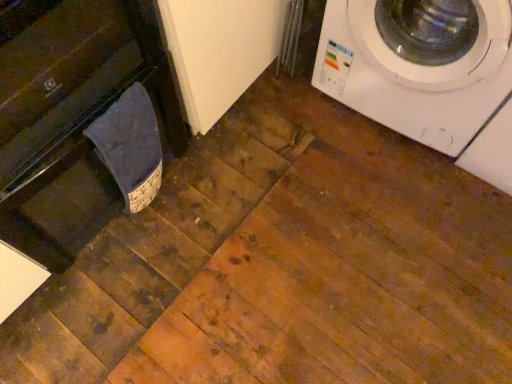
Question: Considering the positions of dark blue fabric at lower left and white glossy washing machine at upper right in the image, is dark blue fabric at lower left taller or shorter than white glossy washing machine at upper right?

Choices:
 (A) tall
 (B) short

Answer: (B)

Question: From a real-world perspective, is dark blue fabric at lower left above or below white glossy washing machine at upper right?

Choices:
 (A) below
 (B) above

Answer: (A)

Question: Which object is positioned farthest from the white glossy washing machine at upper right?

Choices:
 (A) dark blue fabric at lower left
 (B) black glossy dishwasher at left

Answer: (B)

Question: Estimate the real-world distances between objects in this image. Which object is farther from the white glossy washing machine at upper right?

Choices:
 (A) black glossy dishwasher at left
 (B) dark blue fabric at lower left

Answer: (A)